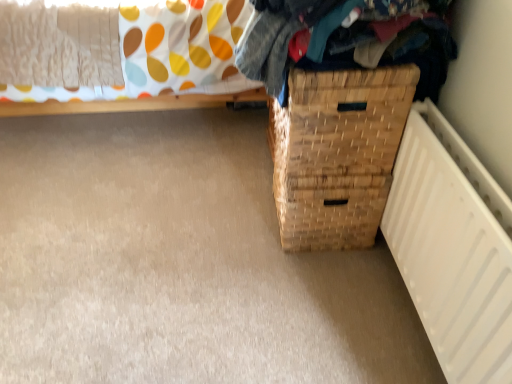
The width and height of the screenshot is (512, 384). I want to click on free spot to the left of woven wood basket at lower right, so click(x=237, y=221).